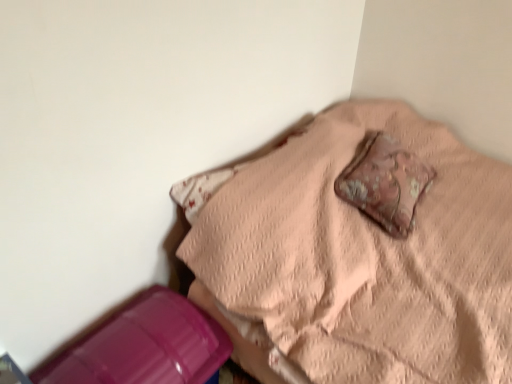
What do you see at coordinates (359, 252) in the screenshot? I see `pink quilted bedspread at upper center` at bounding box center [359, 252].

Image resolution: width=512 pixels, height=384 pixels. In order to click on pink quilted bedspread at upper center in this screenshot , I will do `click(359, 252)`.

Measure the distance between rusty fabric pillow at center and camera.

5.03 feet.

What do you see at coordinates (385, 183) in the screenshot?
I see `rusty fabric pillow at center` at bounding box center [385, 183].

Looking at this image, what is the approximate height of rusty fabric pillow at center?

rusty fabric pillow at center is 10.38 inches tall.

Where is `rusty fabric pillow at center`? Image resolution: width=512 pixels, height=384 pixels. rusty fabric pillow at center is located at coordinates (385, 183).

The height and width of the screenshot is (384, 512). What are the coordinates of `pink quilted bedspread at upper center` in the screenshot? It's located at (359, 252).

Is rusty fabric pillow at center to the right of pink quilted bedspread at upper center from the viewer's perspective?

Yes.

Considering the relative positions of rusty fabric pillow at center and pink quilted bedspread at upper center in the image provided, is rusty fabric pillow at center behind pink quilted bedspread at upper center?

Yes, it is.

Does point (367, 186) come closer to viewer compared to point (424, 158)?

Yes.

From the image's perspective, which one is positioned higher, rusty fabric pillow at center or pink quilted bedspread at upper center?

rusty fabric pillow at center is shown above in the image.

From a real-world perspective, is rusty fabric pillow at center located higher than pink quilted bedspread at upper center?

Yes, from a real-world perspective, rusty fabric pillow at center is on top of pink quilted bedspread at upper center.

Which object is wider, rusty fabric pillow at center or pink quilted bedspread at upper center?

With larger width is pink quilted bedspread at upper center.

Considering the sizes of rusty fabric pillow at center and pink quilted bedspread at upper center in the image, is rusty fabric pillow at center taller or shorter than pink quilted bedspread at upper center?

Considering their sizes, rusty fabric pillow at center has less height than pink quilted bedspread at upper center.

Which of these two, rusty fabric pillow at center or pink quilted bedspread at upper center, is bigger?

Bigger between the two is pink quilted bedspread at upper center.

Could pink quilted bedspread at upper center be considered to be inside rusty fabric pillow at center?

Actually, pink quilted bedspread at upper center is outside rusty fabric pillow at center.

Can you see rusty fabric pillow at center touching pink quilted bedspread at upper center?

No, rusty fabric pillow at center is not with pink quilted bedspread at upper center.

Is pink quilted bedspread at upper center at the back of rusty fabric pillow at center?

Yes, pink quilted bedspread at upper center is at the back of rusty fabric pillow at center.

How distant is rusty fabric pillow at center from pink quilted bedspread at upper center?

rusty fabric pillow at center is 7.46 inches away from pink quilted bedspread at upper center.

Identify the location of furniture that is in front of the rusty fabric pillow at center. This screenshot has width=512, height=384. (x=359, y=252).

Based on the photo, visually, is pink quilted bedspread at upper center positioned to the left or to the right of rusty fabric pillow at center?

Based on their positions, pink quilted bedspread at upper center is located to the left of rusty fabric pillow at center.

In the image, is pink quilted bedspread at upper center positioned in front of or behind rusty fabric pillow at center?

In the image, pink quilted bedspread at upper center appears in front of rusty fabric pillow at center.

Which point is more distant from viewer, (398, 269) or (388, 177)?

The point (388, 177) is farther.

From the image's perspective, is pink quilted bedspread at upper center below rusty fabric pillow at center?

Yes.

From a real-world perspective, between pink quilted bedspread at upper center and rusty fabric pillow at center, who is vertically lower?

pink quilted bedspread at upper center.

Looking at their sizes, would you say pink quilted bedspread at upper center is wider or thinner than rusty fabric pillow at center?

Clearly, pink quilted bedspread at upper center has more width compared to rusty fabric pillow at center.

Considering the sizes of pink quilted bedspread at upper center and rusty fabric pillow at center in the image, is pink quilted bedspread at upper center taller or shorter than rusty fabric pillow at center?

In the image, pink quilted bedspread at upper center appears to be taller than rusty fabric pillow at center.

Considering the sizes of objects pink quilted bedspread at upper center and rusty fabric pillow at center in the image provided, who is bigger, pink quilted bedspread at upper center or rusty fabric pillow at center?

Bigger between the two is pink quilted bedspread at upper center.

Is pink quilted bedspread at upper center situated inside rusty fabric pillow at center or outside?

pink quilted bedspread at upper center exists outside the volume of rusty fabric pillow at center.

Is pink quilted bedspread at upper center not close to rusty fabric pillow at center?

They are positioned close to each other.

Is pink quilted bedspread at upper center oriented towards rusty fabric pillow at center?

No, pink quilted bedspread at upper center is not aimed at rusty fabric pillow at center.

What are the coordinates of `pillow above the pink quilted bedspread at upper center (from the image's perspective)` in the screenshot? It's located at (385, 183).

You are a GUI agent. You are given a task and a screenshot of the screen. Output one action in this format:
    pyautogui.click(x=<x>, y=<y>)
    Task: Click on the pillow located above the pink quilted bedspread at upper center (from the image's perspective)
    The image size is (512, 384).
    Given the screenshot: What is the action you would take?
    pyautogui.click(x=385, y=183)

Find the location of a particular element. pillow positioned vertically above the pink quilted bedspread at upper center (from a real-world perspective) is located at coordinates (385, 183).